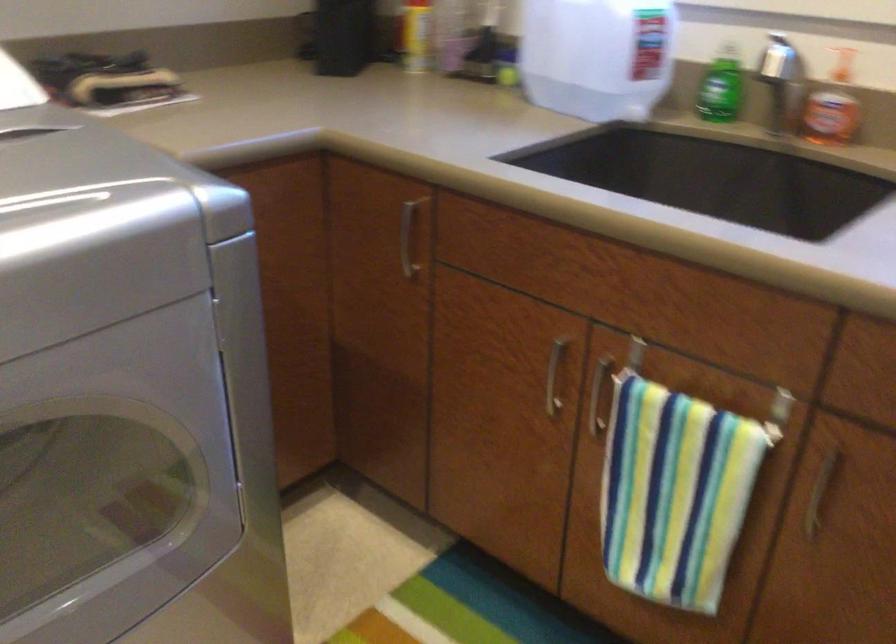
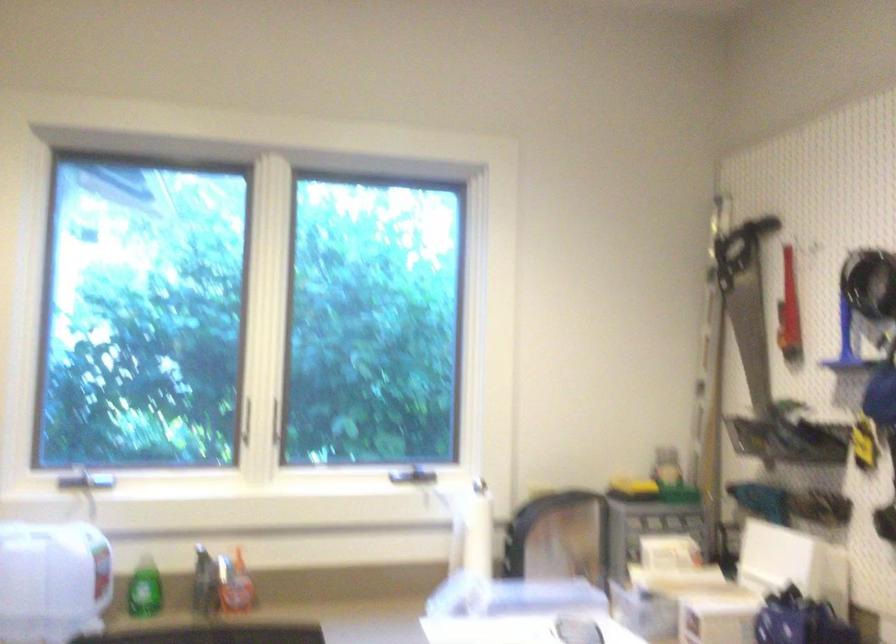
Where in the second image is the point corresponding to the point at 712,90 from the first image?

(143, 589)